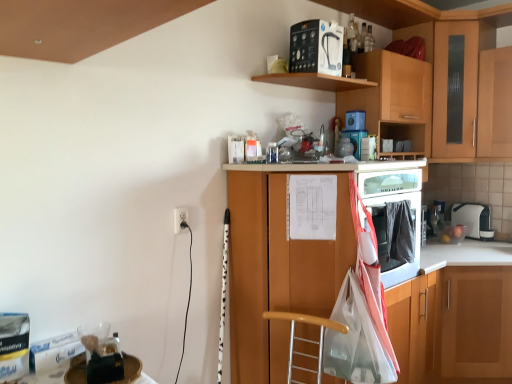
Identify the location of wooden cabinet at center, the fourth cabinetry in the right-to-left sequence. This screenshot has height=384, width=512. (x=277, y=267).

You are a GUI agent. You are given a task and a screenshot of the screen. Output one action in this format:
    pyautogui.click(x=<x>, y=<y>)
    Task: Click on the wooden shelf at upper center
    This screenshot has height=384, width=512.
    Given the screenshot: What is the action you would take?
    pyautogui.click(x=315, y=81)

Locate an element on the screen. The image size is (512, 384). white matte water filter at upper center, the first appliance in the left-to-right sequence is located at coordinates (316, 47).

In order to face wooden cabinet at upper right, the 2th cabinetry in the left-to-right sequence, should I rotate leftwards or rightwards?

Turn right by 17.961 degrees to look at wooden cabinet at upper right, the 2th cabinetry in the left-to-right sequence.

Locate an element on the screen. This screenshot has height=384, width=512. white plastic toaster at upper right, positioned as the 4th appliance in left-to-right order is located at coordinates (471, 218).

Measure the distance between point (470, 227) and camera.

Point (470, 227) and camera are 3.17 meters apart from each other.

The width and height of the screenshot is (512, 384). What are the coordinates of `wooden cabinet at center, positioned as the 1th cabinetry in left-to-right order` in the screenshot? It's located at (277, 267).

Find the location of `shelf in front of the wooden cabinet at right, which ranks as the 3th cabinetry in left-to-right order`. shelf in front of the wooden cabinet at right, which ranks as the 3th cabinetry in left-to-right order is located at coordinates (315, 81).

How different are the orientations of wooden cabinet at right, which ranks as the 3th cabinetry in left-to-right order, and wooden shelf at upper center in degrees?

wooden cabinet at right, which ranks as the 3th cabinetry in left-to-right order, and wooden shelf at upper center are facing 0.674 degrees away from each other.

Between wooden cabinet at right, the second cabinetry in the right-to-left sequence, and wooden shelf at upper center, which one appears on the right side from the viewer's perspective?

wooden cabinet at right, the second cabinetry in the right-to-left sequence.

How much distance is there between wooden cabinet at right, which ranks as the 3th cabinetry in left-to-right order, and wooden shelf at upper center?

A distance of 4.36 feet exists between wooden cabinet at right, which ranks as the 3th cabinetry in left-to-right order, and wooden shelf at upper center.

From the image's perspective, relative to wooden cabinet at upper right, marked as the fourth cabinetry in a left-to-right arrangement, is wooden cabinet at right, the second cabinetry in the right-to-left sequence, above or below?

Based on their image positions, wooden cabinet at right, the second cabinetry in the right-to-left sequence, is located beneath wooden cabinet at upper right, marked as the fourth cabinetry in a left-to-right arrangement.

Does wooden cabinet at right, which ranks as the 3th cabinetry in left-to-right order, have a smaller size compared to wooden cabinet at upper right, the 1th cabinetry when ordered from right to left?

Correct, wooden cabinet at right, which ranks as the 3th cabinetry in left-to-right order, occupies less space than wooden cabinet at upper right, the 1th cabinetry when ordered from right to left.

Considering the sizes of objects wooden cabinet at right, which ranks as the 3th cabinetry in left-to-right order, and wooden cabinet at upper right, the 1th cabinetry when ordered from right to left, in the image provided, who is shorter, wooden cabinet at right, which ranks as the 3th cabinetry in left-to-right order, or wooden cabinet at upper right, the 1th cabinetry when ordered from right to left,?

Standing shorter between the two is wooden cabinet at upper right, the 1th cabinetry when ordered from right to left.

Looking at this image, which object is further away from the camera taking this photo, wooden cabinet at right, the second cabinetry in the right-to-left sequence, or wooden cabinet at upper right, the 1th cabinetry when ordered from right to left?

A: wooden cabinet at upper right, the 1th cabinetry when ordered from right to left, is further from the camera.

Identify the location of the 2nd cabinetry in front when counting from the white glossy counter at lower right. The height and width of the screenshot is (384, 512). (415, 325).

Can we say white glossy counter at lower right lies outside wooden cabinet at right, which ranks as the 3th cabinetry in left-to-right order?

Absolutely, white glossy counter at lower right is external to wooden cabinet at right, which ranks as the 3th cabinetry in left-to-right order.

Which is nearer, (436, 319) or (429, 319)?

Point (436, 319) is positioned farther from the camera compared to point (429, 319).

How many degrees apart are the facing directions of white glossy counter at lower right and wooden cabinet at right, which ranks as the 3th cabinetry in left-to-right order?

white glossy counter at lower right and wooden cabinet at right, which ranks as the 3th cabinetry in left-to-right order, are facing 45.5 degrees away from each other.

Are wooden cabinet at center, positioned as the 1th cabinetry in left-to-right order, and wooden shelf at upper center beside each other?

wooden cabinet at center, positioned as the 1th cabinetry in left-to-right order, is not next to wooden shelf at upper center, and they're not touching.

Is wooden cabinet at center, positioned as the 1th cabinetry in left-to-right order, taller than wooden shelf at upper center?

Yes, wooden cabinet at center, positioned as the 1th cabinetry in left-to-right order, is taller than wooden shelf at upper center.

Between wooden cabinet at center, the fourth cabinetry in the right-to-left sequence, and wooden shelf at upper center, which one appears on the left side from the viewer's perspective?

From the viewer's perspective, wooden shelf at upper center appears more on the left side.

Is wooden cabinet at center, the fourth cabinetry in the right-to-left sequence, facing away from wooden shelf at upper center?

No, wooden cabinet at center, the fourth cabinetry in the right-to-left sequence,'s orientation is not away from wooden shelf at upper center.

Is blue plastic container at upper center, arranged as the second appliance when viewed from the top, shorter than wooden shelf at upper center?

No, blue plastic container at upper center, arranged as the second appliance when viewed from the top, is not shorter than wooden shelf at upper center.

Does blue plastic container at upper center, the 3th appliance positioned from the right, have a smaller size compared to wooden shelf at upper center?

Indeed, blue plastic container at upper center, the 3th appliance positioned from the right, has a smaller size compared to wooden shelf at upper center.

Looking at this image, from the image's perspective, does blue plastic container at upper center, the 2th appliance in the left-to-right sequence, appear higher than wooden shelf at upper center?

No, from the image's perspective, blue plastic container at upper center, the 2th appliance in the left-to-right sequence, is not above wooden shelf at upper center.

Is there a large distance between blue plastic container at upper center, arranged as the second appliance when viewed from the top, and wooden shelf at upper center?

blue plastic container at upper center, arranged as the second appliance when viewed from the top, is near wooden shelf at upper center, not far away.

From the image's perspective, who appears lower, white plastic toaster at upper right, which is counted as the first appliance, starting from the bottom, or blue glossy coffee maker at upper center, which ranks as the 3th appliance in top-to-bottom order?

white plastic toaster at upper right, which is counted as the first appliance, starting from the bottom, appears lower in the image.

Is white plastic toaster at upper right, positioned as the 4th appliance in left-to-right order, in contact with blue glossy coffee maker at upper center, arranged as the 2th appliance when viewed from the front?

No.

Which is behind, point (470, 231) or point (357, 144)?

Positioned behind is point (470, 231).

Is white plastic toaster at upper right, which appears as the first appliance when viewed from the right, smaller than blue glossy coffee maker at upper center, arranged as the 2th appliance when viewed from the front?

Incorrect, white plastic toaster at upper right, which appears as the first appliance when viewed from the right, is not smaller in size than blue glossy coffee maker at upper center, arranged as the 2th appliance when viewed from the front.

Considering the positions of objects wooden cabinet at upper right, the 1th cabinetry when ordered from right to left, and white matte water filter at upper center, the first appliance in the top-to-bottom sequence, in the image provided, who is more to the left, wooden cabinet at upper right, the 1th cabinetry when ordered from right to left, or white matte water filter at upper center, the first appliance in the top-to-bottom sequence,?

white matte water filter at upper center, the first appliance in the top-to-bottom sequence, is more to the left.

Which is nearer, (481, 146) or (308, 39)?

The point (308, 39) is more forward.

From a real-world perspective, between wooden cabinet at upper right, the 1th cabinetry when ordered from right to left, and white matte water filter at upper center, which ranks as the 4th appliance in right-to-left order, who is vertically lower?

wooden cabinet at upper right, the 1th cabinetry when ordered from right to left, from a real-world perspective.

Measure the distance between wooden cabinet at upper right, marked as the fourth cabinetry in a left-to-right arrangement, and white matte water filter at upper center, which ranks as the 4th appliance in right-to-left order.

wooden cabinet at upper right, marked as the fourth cabinetry in a left-to-right arrangement, and white matte water filter at upper center, which ranks as the 4th appliance in right-to-left order, are 4.39 feet apart from each other.

What are the coordinates of `shelf to the left of wooden cabinet at right, the second cabinetry in the right-to-left sequence` in the screenshot? It's located at (315, 81).

Image resolution: width=512 pixels, height=384 pixels. In order to click on the 3rd cabinetry located beneath the wooden cabinet at upper right, marked as the fourth cabinetry in a left-to-right arrangement (from a real-world perspective) in this screenshot , I will do `click(415, 325)`.

From the image, which object appears to be farther from wooden cabinet at right, which ranks as the 3th cabinetry in left-to-right order, wooden shelf at upper center or white plastic toaster at upper right, positioned as the fourth appliance in front-to-back order?

wooden shelf at upper center.

Based on their spatial positions, is white matte water filter at upper center, which ranks as the 4th appliance in right-to-left order, or wooden cabinet at upper right, marked as the fourth cabinetry in a left-to-right arrangement, closer to wooden shelf at upper center?

white matte water filter at upper center, which ranks as the 4th appliance in right-to-left order, is positioned closer to the anchor wooden shelf at upper center.

Estimate the real-world distances between objects in this image. Which object is further from wooden cabinet at center, the fourth cabinetry in the right-to-left sequence, white matte water filter at upper center, which is the first appliance from front to back, or blue plastic container at upper center, the 3th appliance positioned from the right?

white matte water filter at upper center, which is the first appliance from front to back, is further to wooden cabinet at center, the fourth cabinetry in the right-to-left sequence.

Considering their positions, is blue plastic container at upper center, the 3th appliance positioned from the right, positioned closer to wooden cabinet at center, positioned as the 1th cabinetry in left-to-right order, than blue glossy coffee maker at upper center, which is the second appliance from bottom to top?

Based on the image, blue glossy coffee maker at upper center, which is the second appliance from bottom to top, appears to be nearer to wooden cabinet at center, positioned as the 1th cabinetry in left-to-right order.

When comparing their distances from wooden cabinet at center, the fourth cabinetry in the right-to-left sequence, does white glossy counter at lower right or white matte water filter at upper center, the first appliance in the top-to-bottom sequence, seem further?

white matte water filter at upper center, the first appliance in the top-to-bottom sequence, lies further to wooden cabinet at center, the fourth cabinetry in the right-to-left sequence, than the other object.

Estimate the real-world distances between objects in this image. Which object is closer to wooden cabinet at upper right, marked as the third cabinetry in a right-to-left arrangement, wooden shelf at upper center or wooden cabinet at center, the fourth cabinetry in the right-to-left sequence?

Based on the image, wooden shelf at upper center appears to be nearer to wooden cabinet at upper right, marked as the third cabinetry in a right-to-left arrangement.

Based on their spatial positions, is blue glossy coffee maker at upper center, the 3th appliance in the back-to-front sequence, or wooden cabinet at center, the fourth cabinetry in the right-to-left sequence, closer to wooden cabinet at right, the second cabinetry in the right-to-left sequence?

wooden cabinet at center, the fourth cabinetry in the right-to-left sequence, is closer to wooden cabinet at right, the second cabinetry in the right-to-left sequence.

When comparing their distances from wooden cabinet at center, positioned as the 1th cabinetry in left-to-right order, does wooden cabinet at upper right, marked as the third cabinetry in a right-to-left arrangement, or wooden cabinet at right, the second cabinetry in the right-to-left sequence, seem closer?

wooden cabinet at right, the second cabinetry in the right-to-left sequence, is closer to wooden cabinet at center, positioned as the 1th cabinetry in left-to-right order.

You are a GUI agent. You are given a task and a screenshot of the screen. Output one action in this format:
    pyautogui.click(x=<x>, y=<y>)
    Task: Click on the electric outlet that lies between wooden shelf at upper center and wooden cabinet at center, the fourth cabinetry in the right-to-left sequence, from top to bottom
    Image resolution: width=512 pixels, height=384 pixels.
    Given the screenshot: What is the action you would take?
    pyautogui.click(x=180, y=219)

At what (x,y) coordinates should I click in order to perform the action: click on counter between white plastic toaster at upper right, positioned as the 4th appliance in left-to-right order, and wooden cabinet at right, the second cabinetry in the right-to-left sequence, in the up-down direction. Please return your answer as a coordinate pair (x, y). Looking at the image, I should click on (455, 315).

You are a GUI agent. You are given a task and a screenshot of the screen. Output one action in this format:
    pyautogui.click(x=<x>, y=<y>)
    Task: Click on the shelf between white plastic electric outlet at lower left and white plastic toaster at upper right, which appears as the first appliance when viewed from the right, from left to right
    This screenshot has height=384, width=512.
    Given the screenshot: What is the action you would take?
    pyautogui.click(x=315, y=81)

Identify the location of cabinetry between white plastic electric outlet at lower left and wooden cabinet at upper right, marked as the third cabinetry in a right-to-left arrangement. (277, 267).